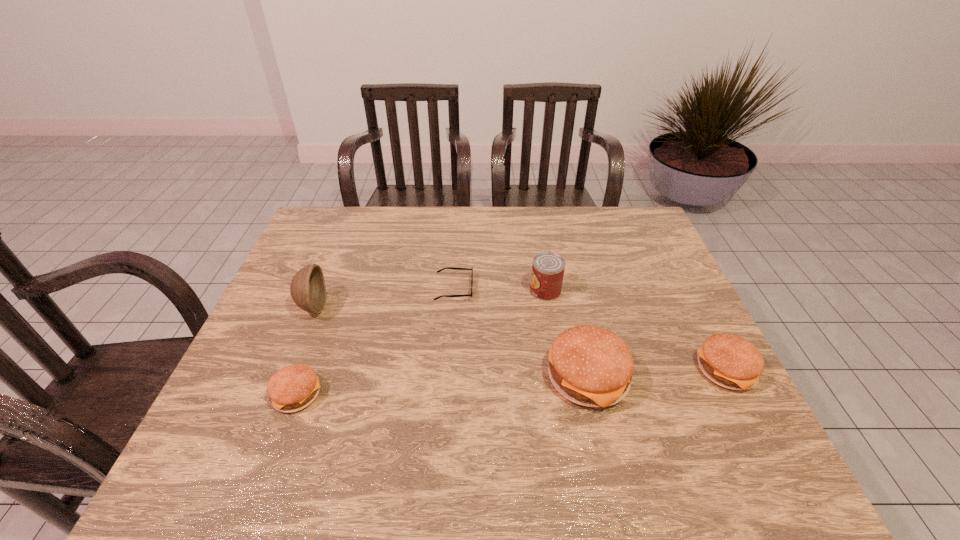
This screenshot has width=960, height=540. I want to click on the leftmost hamburger, so click(x=292, y=388).

Identify the location of the second shortest object. (292, 388).

Find the location of `the tallest hamburger`. the tallest hamburger is located at coordinates (589, 365).

Find the location of `the second shortest hamburger`. the second shortest hamburger is located at coordinates (730, 361).

At what (x,y) coordinates should I click in order to perform the action: click on the rightmost object. Please return your answer as a coordinate pair (x, y). This screenshot has width=960, height=540. Looking at the image, I should click on (730, 361).

This screenshot has height=540, width=960. What are the coordinates of `sunglasses` in the screenshot? It's located at (447, 267).

What are the coordinates of `the third object from left to right` in the screenshot? It's located at (447, 267).

Where is `can`? Image resolution: width=960 pixels, height=540 pixels. can is located at coordinates (548, 268).

Locate an element on the screen. This screenshot has width=960, height=540. the tallest object is located at coordinates (308, 291).

Image resolution: width=960 pixels, height=540 pixels. I want to click on vacant space situated on the left of the shortest hamburger, so click(229, 394).